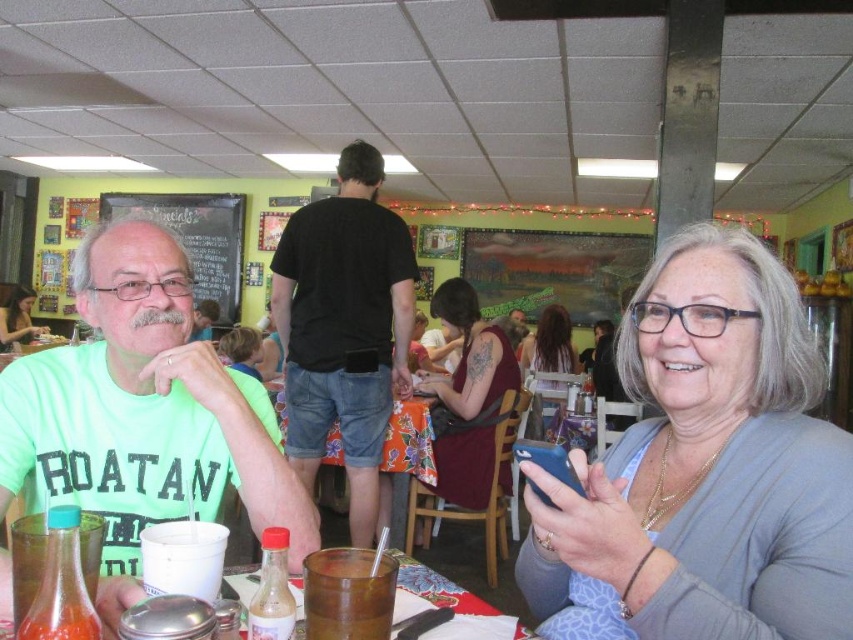
What do you see at coordinates (705, 468) in the screenshot? This screenshot has width=853, height=640. I see `gray fabric shirt at center` at bounding box center [705, 468].

Can you confirm if gray fabric shirt at center is wider than maroon fabric dress at center?

No, gray fabric shirt at center is not wider than maroon fabric dress at center.

Where is `gray fabric shirt at center`? gray fabric shirt at center is located at coordinates (705, 468).

Does black cotton shirt at center have a lesser width compared to green t-shirt at left?

Yes.

What do you see at coordinates (344, 326) in the screenshot?
I see `black cotton shirt at center` at bounding box center [344, 326].

Where is `black cotton shirt at center`? black cotton shirt at center is located at coordinates (344, 326).

Can you confirm if black cotton shirt at center is bigger than smooth brown hair at center?

Indeed, black cotton shirt at center has a larger size compared to smooth brown hair at center.

Between point (292, 310) and point (238, 349), which one is positioned behind?

The point (238, 349) is behind.

At what (x,y) coordinates should I click in order to perform the action: click on black cotton shirt at center. Please return your answer as a coordinate pair (x, y). Looking at the image, I should click on (344, 326).